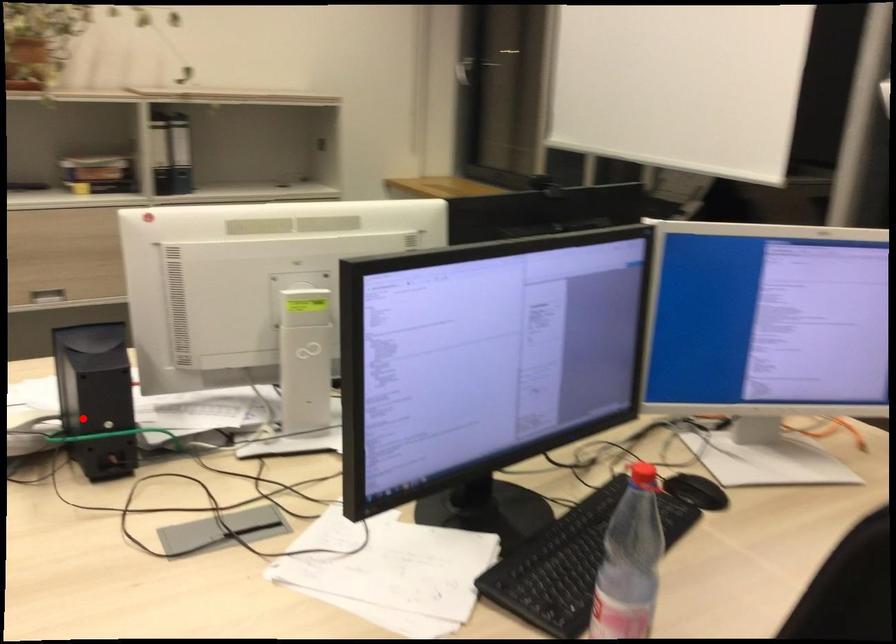
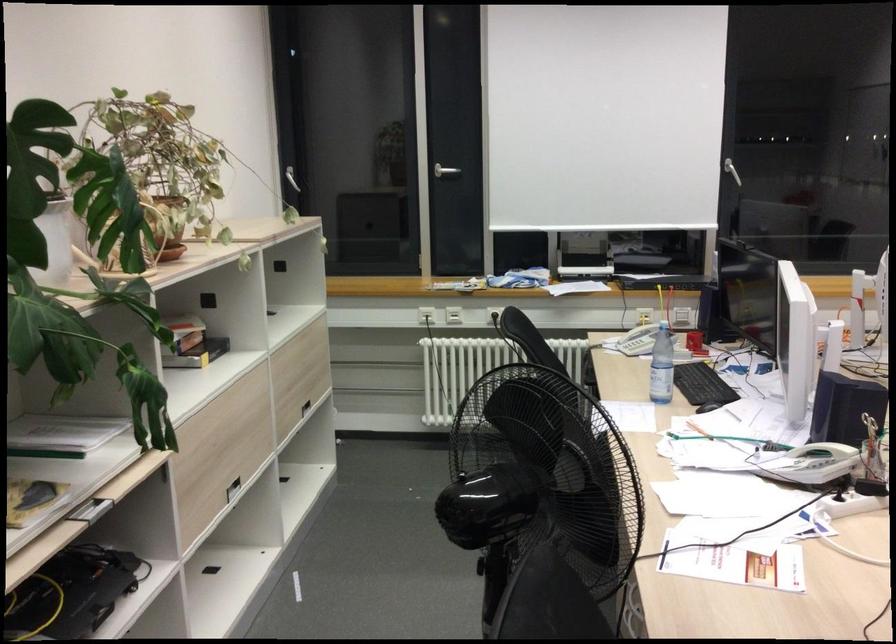
In the second image, find the point that corresponds to the highlighted location in the first image.

(814, 464)